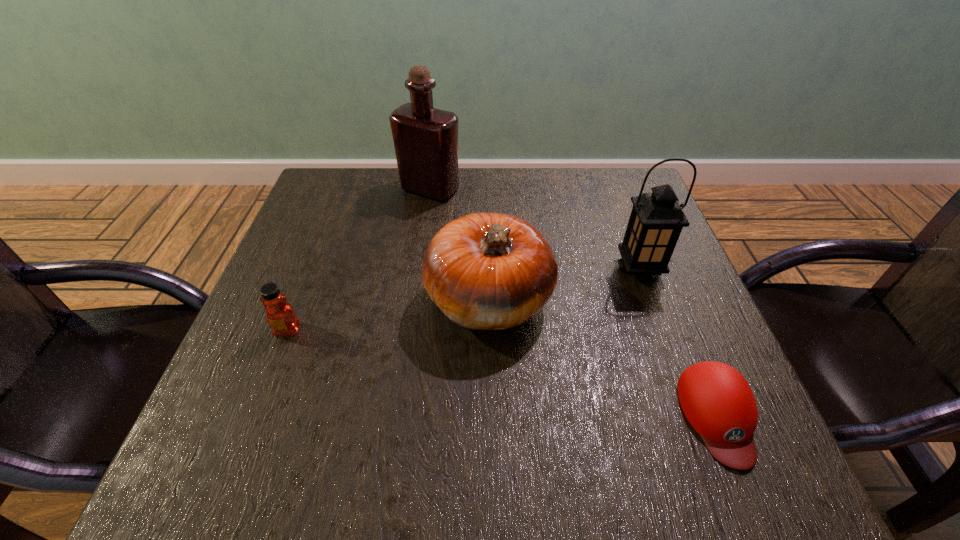
Locate an element on the screen. vacant space situated on the front label of the honey is located at coordinates (265, 387).

Find the location of a particular element. The image size is (960, 540). object that is positioned at the far edge is located at coordinates (x=425, y=139).

Locate an element on the screen. The height and width of the screenshot is (540, 960). object that is positioned at the near edge is located at coordinates (716, 399).

Find the location of a particular element. This screenshot has height=540, width=960. object that is at the left edge is located at coordinates (280, 315).

Locate an element on the screen. The height and width of the screenshot is (540, 960). lantern positioned at the right edge is located at coordinates (656, 220).

Locate an element on the screen. baseball cap that is at the right edge is located at coordinates (716, 399).

At what (x,y) coordinates should I click in order to perform the action: click on object positioned at the near right corner. Please return your answer as a coordinate pair (x, y). Looking at the image, I should click on (716, 399).

At what (x,y) coordinates should I click in order to perform the action: click on vacant space at the far edge of the desktop. Please return your answer as a coordinate pair (x, y). This screenshot has height=540, width=960. Looking at the image, I should click on (567, 218).

In the image, there is a desktop. Where is `vacant space at the left edge`? Image resolution: width=960 pixels, height=540 pixels. vacant space at the left edge is located at coordinates (304, 298).

Find the location of a particular element. The height and width of the screenshot is (540, 960). blank space at the right edge of the desktop is located at coordinates (655, 296).